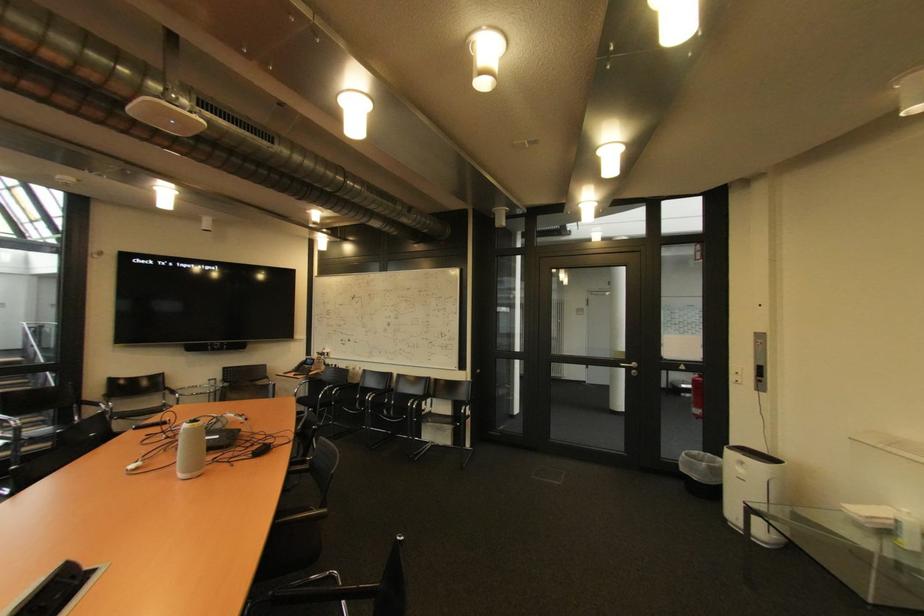
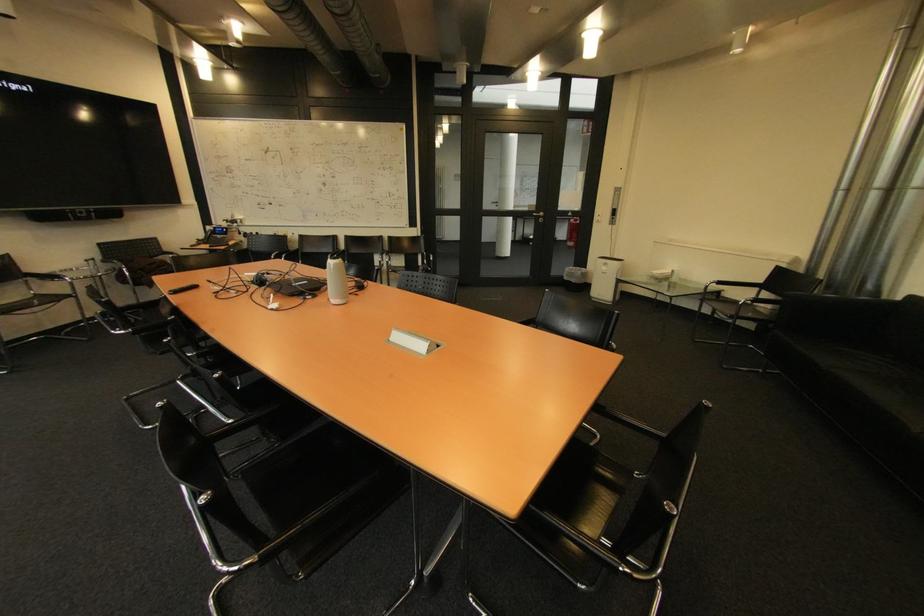
Where in the second image is the point corresponding to pixel 690 471 from the first image?

(574, 280)